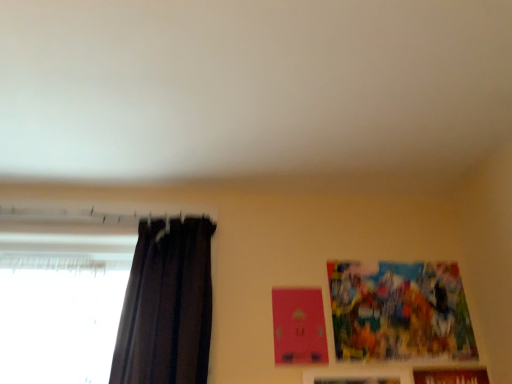
I want to click on wooden picture frame at lower right, which is the 2th picture frame in top-to-bottom order, so click(x=357, y=376).

Image resolution: width=512 pixels, height=384 pixels. What do you see at coordinates (399, 311) in the screenshot? I see `colorful paper picture frame at upper right, the 3th picture frame ordered from the bottom` at bounding box center [399, 311].

At what (x,y) coordinates should I click in order to perform the action: click on dark matte curtain at left. Please return your answer as a coordinate pair (x, y). Image resolution: width=512 pixels, height=384 pixels. Looking at the image, I should click on (167, 305).

You are a GUI agent. You are given a task and a screenshot of the screen. Output one action in this format:
    pyautogui.click(x=<x>, y=<y>)
    Task: Click on the wooden picture frame at lower right, which is the 2th picture frame in top-to-bottom order
    
    Given the screenshot: What is the action you would take?
    pyautogui.click(x=357, y=376)

Is dark matte curtain at left inside or outside of colorful paper picture frame at upper right, which is the 1th picture frame from top to bottom?

dark matte curtain at left exists outside the volume of colorful paper picture frame at upper right, which is the 1th picture frame from top to bottom.

Does dark matte curtain at left appear on the left side of colorful paper picture frame at upper right, which is the 1th picture frame from top to bottom?

Correct, you'll find dark matte curtain at left to the left of colorful paper picture frame at upper right, which is the 1th picture frame from top to bottom.

Does colorful paper picture frame at upper right, the 3th picture frame ordered from the bottom, have a greater width compared to brown wooden picture frame at lower right, which is the third picture frame in top-to-bottom order?

In fact, colorful paper picture frame at upper right, the 3th picture frame ordered from the bottom, might be narrower than brown wooden picture frame at lower right, which is the third picture frame in top-to-bottom order.

Which is more to the right, colorful paper picture frame at upper right, which is the 1th picture frame from top to bottom, or brown wooden picture frame at lower right, the 1th picture frame ordered from the bottom?

brown wooden picture frame at lower right, the 1th picture frame ordered from the bottom.

From the image's perspective, between colorful paper picture frame at upper right, the 3th picture frame ordered from the bottom, and brown wooden picture frame at lower right, the 1th picture frame ordered from the bottom, who is located below?

brown wooden picture frame at lower right, the 1th picture frame ordered from the bottom, is shown below in the image.

Is point (362, 269) in front of point (472, 370)?

No, (362, 269) is further to viewer.

Can you confirm if wooden picture frame at lower right, which ranks as the 2th picture frame in bottom-to-top order, is shorter than brown wooden picture frame at lower right, the 1th picture frame ordered from the bottom?

Correct, wooden picture frame at lower right, which ranks as the 2th picture frame in bottom-to-top order, is not as tall as brown wooden picture frame at lower right, the 1th picture frame ordered from the bottom.

Is wooden picture frame at lower right, which ranks as the 2th picture frame in bottom-to-top order, oriented away from brown wooden picture frame at lower right, the 1th picture frame ordered from the bottom?

wooden picture frame at lower right, which ranks as the 2th picture frame in bottom-to-top order, does not have its back to brown wooden picture frame at lower right, the 1th picture frame ordered from the bottom.

Would you say wooden picture frame at lower right, which is the 2th picture frame in top-to-bottom order, is a long distance from brown wooden picture frame at lower right, which is the third picture frame in top-to-bottom order?

wooden picture frame at lower right, which is the 2th picture frame in top-to-bottom order, is actually quite close to brown wooden picture frame at lower right, which is the third picture frame in top-to-bottom order.

From the image's perspective, does wooden picture frame at lower right, which ranks as the 2th picture frame in bottom-to-top order, appear lower than brown wooden picture frame at lower right, which is the third picture frame in top-to-bottom order?

Actually, wooden picture frame at lower right, which ranks as the 2th picture frame in bottom-to-top order, appears above brown wooden picture frame at lower right, which is the third picture frame in top-to-bottom order, in the image.

Is brown wooden picture frame at lower right, the 1th picture frame ordered from the bottom, shorter than dark matte curtain at left?

Indeed, brown wooden picture frame at lower right, the 1th picture frame ordered from the bottom, has a lesser height compared to dark matte curtain at left.

Which of these two, brown wooden picture frame at lower right, which is the third picture frame in top-to-bottom order, or dark matte curtain at left, is bigger?

dark matte curtain at left is bigger.

Considering the points (426, 378) and (127, 327), which point is behind, point (426, 378) or point (127, 327)?

Point (426, 378)

From the image's perspective, between brown wooden picture frame at lower right, which is the third picture frame in top-to-bottom order, and wooden picture frame at lower right, which ranks as the 2th picture frame in bottom-to-top order, who is located below?

brown wooden picture frame at lower right, which is the third picture frame in top-to-bottom order, appears lower in the image.

Between brown wooden picture frame at lower right, the 1th picture frame ordered from the bottom, and wooden picture frame at lower right, which is the 2th picture frame in top-to-bottom order, which one appears on the right side from the viewer's perspective?

brown wooden picture frame at lower right, the 1th picture frame ordered from the bottom, is more to the right.

Can you confirm if brown wooden picture frame at lower right, the 1th picture frame ordered from the bottom, is bigger than wooden picture frame at lower right, which is the 2th picture frame in top-to-bottom order?

Yes.

Is brown wooden picture frame at lower right, the 1th picture frame ordered from the bottom, closer to the viewer compared to wooden picture frame at lower right, which ranks as the 2th picture frame in bottom-to-top order?

Yes, it is in front of wooden picture frame at lower right, which ranks as the 2th picture frame in bottom-to-top order.

Is dark matte curtain at left bigger or smaller than wooden picture frame at lower right, which is the 2th picture frame in top-to-bottom order?

Considering their sizes, dark matte curtain at left takes up more space than wooden picture frame at lower right, which is the 2th picture frame in top-to-bottom order.

Is dark matte curtain at left facing towards wooden picture frame at lower right, which is the 2th picture frame in top-to-bottom order?

No, dark matte curtain at left does not turn towards wooden picture frame at lower right, which is the 2th picture frame in top-to-bottom order.

Which object is thinner, dark matte curtain at left or wooden picture frame at lower right, which is the 2th picture frame in top-to-bottom order?

wooden picture frame at lower right, which is the 2th picture frame in top-to-bottom order, is thinner.

Which is in front, point (191, 373) or point (374, 372)?

The point (191, 373) is more forward.

What's the angular difference between brown wooden picture frame at lower right, which is the third picture frame in top-to-bottom order, and colorful paper picture frame at upper right, the 3th picture frame ordered from the bottom,'s facing directions?

The facing directions of brown wooden picture frame at lower right, which is the third picture frame in top-to-bottom order, and colorful paper picture frame at upper right, the 3th picture frame ordered from the bottom, are 0.00396 degrees apart.

Is brown wooden picture frame at lower right, the 1th picture frame ordered from the bottom, beside colorful paper picture frame at upper right, the 3th picture frame ordered from the bottom?

They are not placed beside each other.

From the image's perspective, relative to colorful paper picture frame at upper right, which is the 1th picture frame from top to bottom, is brown wooden picture frame at lower right, the 1th picture frame ordered from the bottom, above or below?

Based on their image positions, brown wooden picture frame at lower right, the 1th picture frame ordered from the bottom, is located beneath colorful paper picture frame at upper right, which is the 1th picture frame from top to bottom.

How much distance is there between brown wooden picture frame at lower right, the 1th picture frame ordered from the bottom, and colorful paper picture frame at upper right, which is the 1th picture frame from top to bottom?

They are 9.31 inches apart.

This screenshot has width=512, height=384. I want to click on picture frame that is the 2nd one when counting rightward from the dark matte curtain at left, so pyautogui.click(x=399, y=311).

Find the location of a particular element. This screenshot has width=512, height=384. the 2nd picture frame below when counting from the colorful paper picture frame at upper right, which is the 1th picture frame from top to bottom (from the image's perspective) is located at coordinates pos(450,375).

Looking at the image, which one is located further to colorful paper picture frame at upper right, the 3th picture frame ordered from the bottom, wooden picture frame at lower right, which ranks as the 2th picture frame in bottom-to-top order, or brown wooden picture frame at lower right, which is the third picture frame in top-to-bottom order?

wooden picture frame at lower right, which ranks as the 2th picture frame in bottom-to-top order.

From the image, which object appears to be farther from colorful paper picture frame at upper right, the 3th picture frame ordered from the bottom, brown wooden picture frame at lower right, which is the third picture frame in top-to-bottom order, or dark matte curtain at left?

Among the two, dark matte curtain at left is located further to colorful paper picture frame at upper right, the 3th picture frame ordered from the bottom.

Based on their spatial positions, is dark matte curtain at left or wooden picture frame at lower right, which ranks as the 2th picture frame in bottom-to-top order, further from colorful paper picture frame at upper right, the 3th picture frame ordered from the bottom?

dark matte curtain at left is positioned further to the anchor colorful paper picture frame at upper right, the 3th picture frame ordered from the bottom.

When comparing their distances from dark matte curtain at left, does wooden picture frame at lower right, which is the 2th picture frame in top-to-bottom order, or brown wooden picture frame at lower right, which is the third picture frame in top-to-bottom order, seem further?

Among the two, brown wooden picture frame at lower right, which is the third picture frame in top-to-bottom order, is located further to dark matte curtain at left.

Which object lies further to the anchor point brown wooden picture frame at lower right, which is the third picture frame in top-to-bottom order, dark matte curtain at left or wooden picture frame at lower right, which ranks as the 2th picture frame in bottom-to-top order?

Among the two, dark matte curtain at left is located further to brown wooden picture frame at lower right, which is the third picture frame in top-to-bottom order.

From the image, which object appears to be nearer to brown wooden picture frame at lower right, the 1th picture frame ordered from the bottom, colorful paper picture frame at upper right, which is the 1th picture frame from top to bottom, or dark matte curtain at left?

Based on the image, colorful paper picture frame at upper right, which is the 1th picture frame from top to bottom, appears to be nearer to brown wooden picture frame at lower right, the 1th picture frame ordered from the bottom.

From the image, which object appears to be nearer to wooden picture frame at lower right, which is the 2th picture frame in top-to-bottom order, dark matte curtain at left or brown wooden picture frame at lower right, which is the third picture frame in top-to-bottom order?

Among the two, brown wooden picture frame at lower right, which is the third picture frame in top-to-bottom order, is located nearer to wooden picture frame at lower right, which is the 2th picture frame in top-to-bottom order.

Estimate the real-world distances between objects in this image. Which object is further from wooden picture frame at lower right, which is the 2th picture frame in top-to-bottom order, brown wooden picture frame at lower right, the 1th picture frame ordered from the bottom, or dark matte curtain at left?

dark matte curtain at left lies further to wooden picture frame at lower right, which is the 2th picture frame in top-to-bottom order, than the other object.

You are a GUI agent. You are given a task and a screenshot of the screen. Output one action in this format:
    pyautogui.click(x=<x>, y=<y>)
    Task: Click on the picture frame that lies between colorful paper picture frame at upper right, the 3th picture frame ordered from the bottom, and brown wooden picture frame at lower right, the 1th picture frame ordered from the bottom, from top to bottom
    
    Given the screenshot: What is the action you would take?
    pyautogui.click(x=357, y=376)

At what (x,y) coordinates should I click in order to perform the action: click on picture frame situated between dark matte curtain at left and colorful paper picture frame at upper right, the 3th picture frame ordered from the bottom, from left to right. Please return your answer as a coordinate pair (x, y). The width and height of the screenshot is (512, 384). Looking at the image, I should click on click(357, 376).